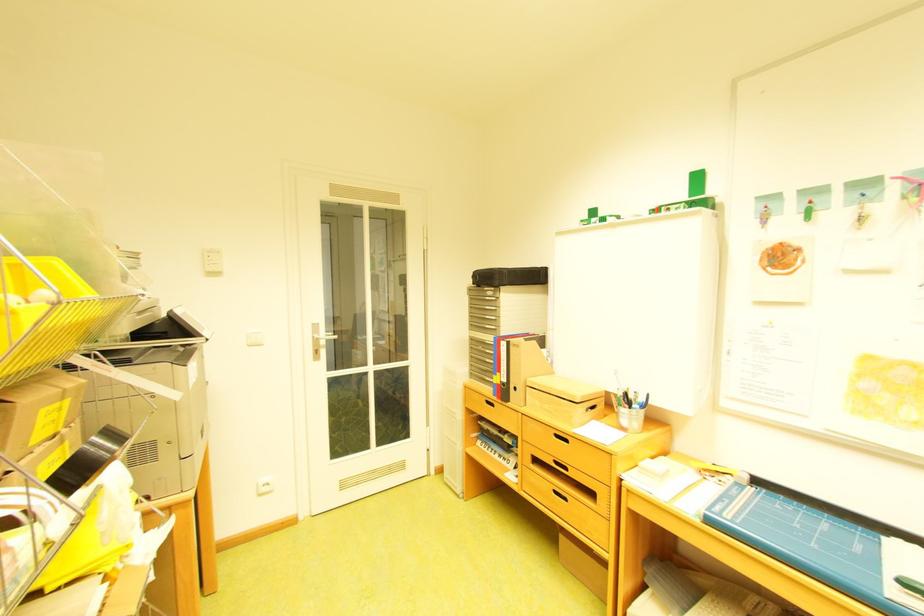
Where would you push the white light switch? Please return your answer as a coordinate pair (x, y).

(213, 257)